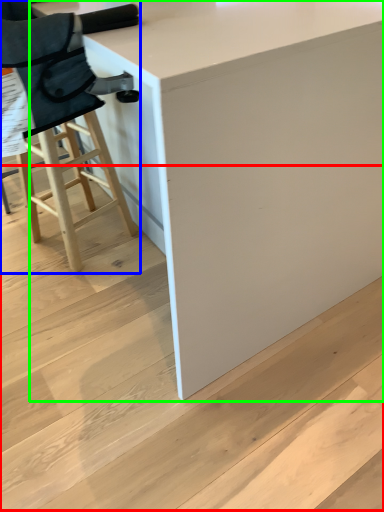
Question: Which object is positioned farthest from stair (highlighted by a red box)? Select from chair (highlighted by a blue box) and table (highlighted by a green box).

Choices:
 (A) chair
 (B) table

Answer: (A)